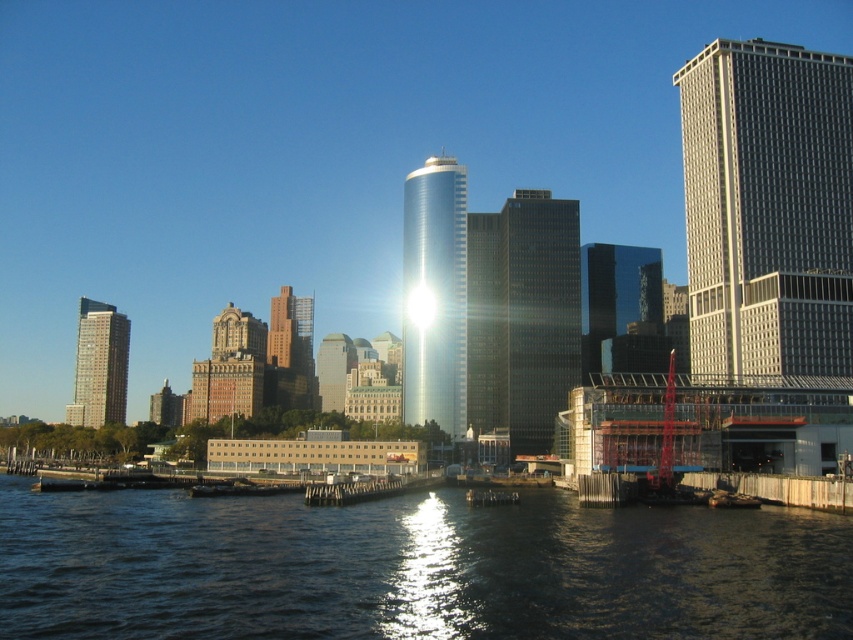
You are standing on the riverbank and see two points in the cityscape. The first point is at coordinates point [543,324] and the second is at point [428,157]. Which point is closer to you?

Point [543,324] is closer to the viewer than point [428,157].

Looking at this image, you are an architect analyzing the cityscape from across the river. You notice the gray glass skyscraper at right and the shiny glass skyscraper at center. Which one has a greater height?

The gray glass skyscraper at right is taller than the shiny glass skyscraper at center.

You are a tourist standing on the riverbank and want to take a photo of the glossy glass skyscraper at center and the brown brick building at center. Which building should you position to the left in your photo to capture both in the frame?

You should position the brown brick building at center to the left in your photo because the glossy glass skyscraper at center is on its right side, allowing both to be captured in the frame.